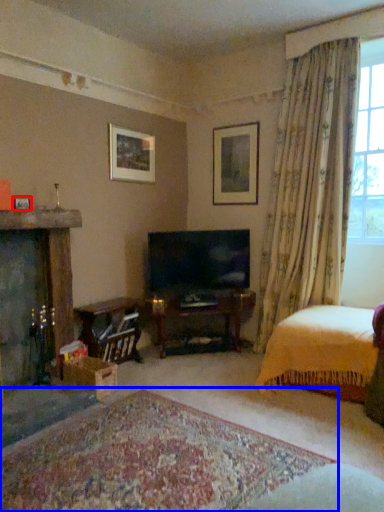
Question: Among these objects, which one is nearest to the camera, picture frame (highlighted by a red box) or plain (highlighted by a blue box)?

Choices:
 (A) picture frame
 (B) plain

Answer: (B)